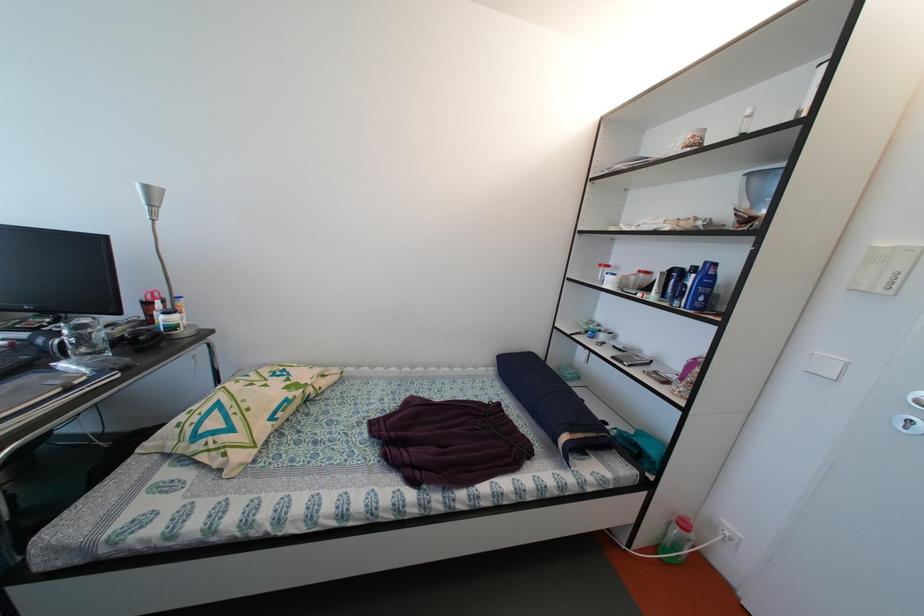
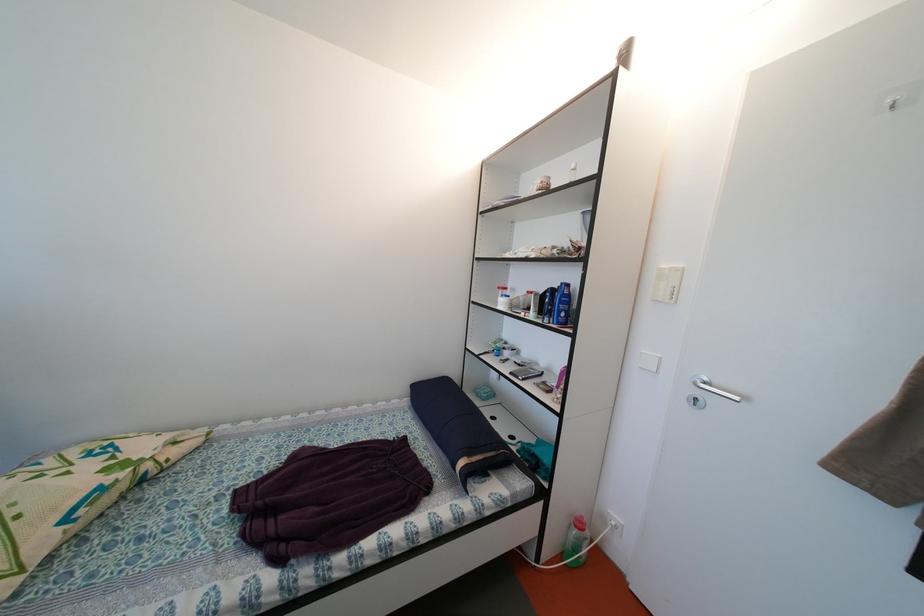
Where in the second image is the point corresponding to (608,270) from the first image?

(505, 293)